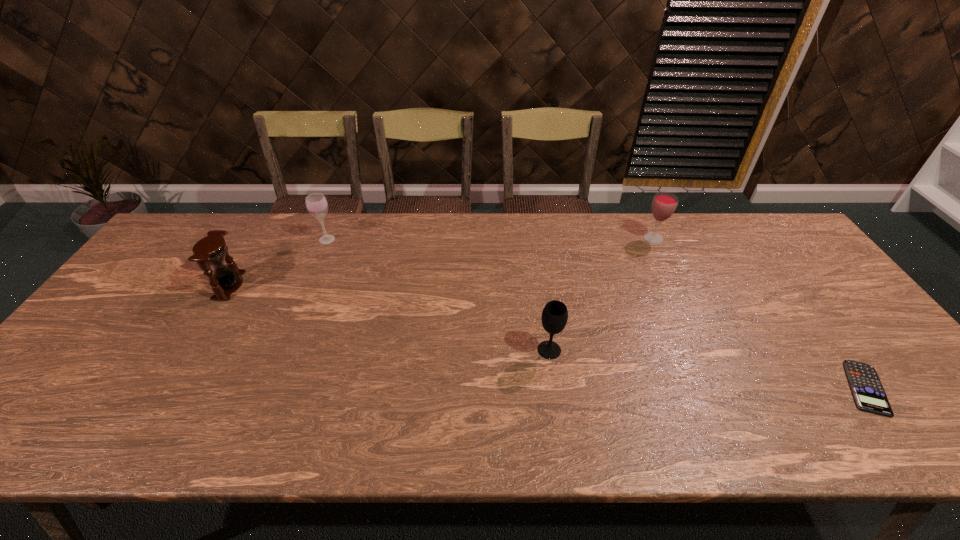
This screenshot has width=960, height=540. In the image, there is a desktop. Identify the location of vacant space at the far left corner. (166, 250).

This screenshot has width=960, height=540. In order to click on free space at the near left corner of the desktop in this screenshot , I will do `click(59, 433)`.

Where is `vacant space at the far right corner of the desktop`? Image resolution: width=960 pixels, height=540 pixels. vacant space at the far right corner of the desktop is located at coordinates (756, 222).

Where is `free point between the hourglass and the rightmost wineglass`? The height and width of the screenshot is (540, 960). free point between the hourglass and the rightmost wineglass is located at coordinates (442, 262).

What are the coordinates of `free point between the rightmost wineglass and the second object from left to right` in the screenshot? It's located at (491, 239).

Find the location of a particular element. free area in between the rightmost wineglass and the leftmost wineglass is located at coordinates (491, 239).

This screenshot has width=960, height=540. In order to click on empty space that is in between the second wineglass from right to left and the leftmost object in this screenshot , I will do `click(390, 318)`.

I want to click on free spot between the rightmost object and the leftmost wineglass, so click(x=596, y=314).

Identify the location of free space between the third nearest object and the calculator. The width and height of the screenshot is (960, 540). (547, 337).

Find the location of a particular element. The height and width of the screenshot is (540, 960). free space between the leftmost object and the fourth object from right to left is located at coordinates (278, 262).